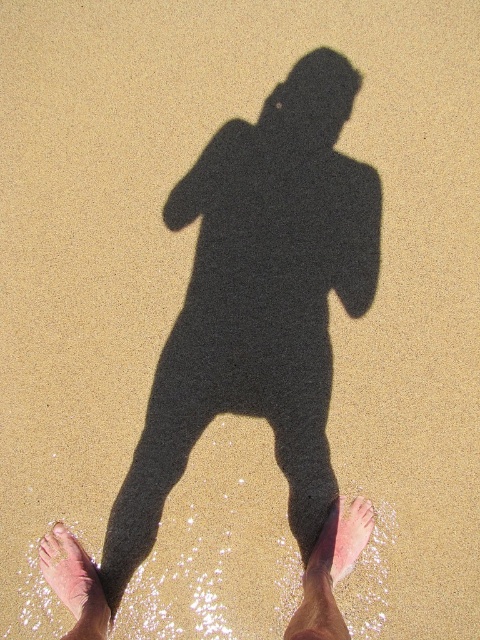
Based on the photo, you are a photographer trying to capture the shadow of the person on the beach. You notice two pink areas in the lower part of the image. Which pink area is wider? The pink skin at lower center or the pink flesh at lower left?

The pink skin at lower center is wider than the pink flesh at lower left.